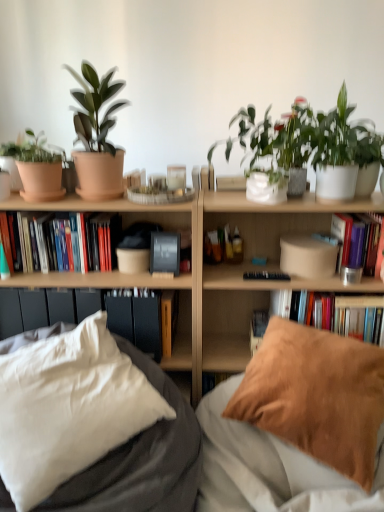
Where is `hardcover book at upper right, the 2th book when ordered from left to right`? hardcover book at upper right, the 2th book when ordered from left to right is located at coordinates (344, 314).

What do you see at coordinates (266, 189) in the screenshot? Image resolution: width=384 pixels, height=512 pixels. I see `white matte flowerpot at center, which appears as the 1th flowerpot when viewed from the right` at bounding box center [266, 189].

The width and height of the screenshot is (384, 512). Find the location of `wooden bookcase at upper center`. wooden bookcase at upper center is located at coordinates point(219,273).

What is the approximate height of wooden bookcase at upper center?

wooden bookcase at upper center is 1.04 meters in height.

How much space does matte terracotta pot at left, acting as the 1th houseplant starting from the left, occupy horizontally?

matte terracotta pot at left, acting as the 1th houseplant starting from the left, is 8.98 inches in width.

Find the location of a particular element. black matte book at center, which is counted as the second paperback book, starting from the top is located at coordinates (147, 322).

Consider the image. How much space does black matte book at center, which appears as the 1th paperback book when viewed from the top, occupy horizontally?

black matte book at center, which appears as the 1th paperback book when viewed from the top, is 2.74 inches in width.

Describe the element at coordinates (97, 136) in the screenshot. The image size is (384, 512). I see `matte terracotta pot at upper left, which ranks as the 2th houseplant in right-to-left order` at that location.

This screenshot has width=384, height=512. In order to click on hardcover book at upper right, the 2th book when ordered from left to right in this screenshot , I will do `click(344, 314)`.

Does wooden bookcase at upper center have a larger size compared to matte terracotta pot at upper left, which ranks as the 2th houseplant in right-to-left order?

Correct, wooden bookcase at upper center is larger in size than matte terracotta pot at upper left, which ranks as the 2th houseplant in right-to-left order.

From the image's perspective, would you say wooden bookcase at upper center is shown under matte terracotta pot at upper left, the second houseplant from the left?

Indeed, from the image's perspective, wooden bookcase at upper center is shown beneath matte terracotta pot at upper left, the second houseplant from the left.

Can we say wooden bookcase at upper center lies outside matte terracotta pot at upper left, the second houseplant from the left?

Yes, wooden bookcase at upper center is located beyond the bounds of matte terracotta pot at upper left, the second houseplant from the left.

Considering the relative sizes of wooden bookcase at upper center and matte terracotta pot at upper left, which ranks as the 2th houseplant in right-to-left order, in the image provided, is wooden bookcase at upper center thinner than matte terracotta pot at upper left, which ranks as the 2th houseplant in right-to-left order,?

Incorrect, the width of wooden bookcase at upper center is not less than that of matte terracotta pot at upper left, which ranks as the 2th houseplant in right-to-left order.

The width and height of the screenshot is (384, 512). In order to click on the 3rd flowerpot above when counting from the black matte book at center, placed as the 2th paperback book when sorted from bottom to top (from the image's perspective) in this screenshot , I will do `click(41, 181)`.

What's the angular difference between matte clay pot at left, marked as the 3th flowerpot in a bottom-to-top arrangement, and black matte book at center, placed as the 2th paperback book when sorted from bottom to top,'s facing directions?

The angular difference between matte clay pot at left, marked as the 3th flowerpot in a bottom-to-top arrangement, and black matte book at center, placed as the 2th paperback book when sorted from bottom to top, is 1.54 degrees.

Considering their positions, is matte clay pot at left, acting as the first flowerpot starting from the top, located in front of or behind black matte book at center, which is counted as the second paperback book, starting from the top?

matte clay pot at left, acting as the first flowerpot starting from the top, is positioned closer to the viewer than black matte book at center, which is counted as the second paperback book, starting from the top.

From the image's perspective, is matte clay pot at left, which appears as the 3th flowerpot when viewed from the right, located beneath black matte book at center, placed as the 2th paperback book when sorted from bottom to top?

Actually, matte clay pot at left, which appears as the 3th flowerpot when viewed from the right, appears above black matte book at center, placed as the 2th paperback book when sorted from bottom to top, in the image.

Looking at this image, could you tell me if green matte plant at upper right, the first houseplant when ordered from right to left, is facing hardcover books at left, marked as the first book in a left-to-right arrangement?

No.

From the image's perspective, is green matte plant at upper right, the first houseplant when ordered from right to left, above hardcover books at left, marked as the first book in a left-to-right arrangement?

Yes, from the image's perspective, green matte plant at upper right, the first houseplant when ordered from right to left, is on top of hardcover books at left, marked as the first book in a left-to-right arrangement.

From the image's perspective, count 1st books downward from the green matte plant at upper right, which appears as the 3th houseplant when viewed from the left, and point to it. Please provide its 2D coordinates.

[(69, 241)]

Based on their positions, is green matte plant at upper right, the first houseplant when ordered from right to left, located to the left or right of hardcover books at left, marked as the first book in a left-to-right arrangement?

green matte plant at upper right, the first houseplant when ordered from right to left, is positioned on hardcover books at left, marked as the first book in a left-to-right arrangement,'s right side.

Is hardcover book at upper right, the second book when ordered from right to left, wider or thinner than black matte book at center, the third paperback book in the bottom-to-top sequence?

Clearly, hardcover book at upper right, the second book when ordered from right to left, has more width compared to black matte book at center, the third paperback book in the bottom-to-top sequence.

Is hardcover book at upper right, the 2th book when ordered from left to right, bigger than black matte book at center, the third paperback book in the bottom-to-top sequence?

Indeed, hardcover book at upper right, the 2th book when ordered from left to right, has a larger size compared to black matte book at center, the third paperback book in the bottom-to-top sequence.

In terms of height, does hardcover book at upper right, the second book when ordered from right to left, look taller or shorter compared to black matte book at center, the third paperback book in the bottom-to-top sequence?

hardcover book at upper right, the second book when ordered from right to left, is taller than black matte book at center, the third paperback book in the bottom-to-top sequence.

Is wooden bookcase at upper center oriented towards brown suede pillow at lower right, which is the second pillow from left to right?

No.

Which is in front, wooden bookcase at upper center or brown suede pillow at lower right, the first pillow when ordered from right to left?

brown suede pillow at lower right, the first pillow when ordered from right to left, is closer to the camera.

Which object is thinner, wooden bookcase at upper center or brown suede pillow at lower right, which is the second pillow from left to right?

brown suede pillow at lower right, which is the second pillow from left to right.

In terms of height, does wooden bookcase at upper center look taller or shorter compared to brown suede pillow at lower right, which is the second pillow from left to right?

In the image, wooden bookcase at upper center appears to be taller than brown suede pillow at lower right, which is the second pillow from left to right.

Considering the positions of objects matte brown pot at center, the second flowerpot viewed from the left, and white soft pillow at lower left, the 1th pillow positioned from the left, in the image provided, who is behind, matte brown pot at center, the second flowerpot viewed from the left, or white soft pillow at lower left, the 1th pillow positioned from the left,?

Positioned behind is matte brown pot at center, the second flowerpot viewed from the left.

Is matte brown pot at center, which is the 1th flowerpot in bottom-to-top order, positioned beyond the bounds of white soft pillow at lower left, the second pillow from the right?

Absolutely, matte brown pot at center, which is the 1th flowerpot in bottom-to-top order, is external to white soft pillow at lower left, the second pillow from the right.

Which point is more distant from viewer, (130,255) or (43,486)?

The point (130,255) is behind.

Is matte brown pot at center, the second flowerpot viewed from the left, positioned far away from white soft pillow at lower left, the 1th pillow positioned from the left?

No, matte brown pot at center, the second flowerpot viewed from the left, is not far from white soft pillow at lower left, the 1th pillow positioned from the left.

Considering the relative sizes of black matte book at center, the third paperback book in the bottom-to-top sequence, and wooden bookcase at upper center in the image provided, is black matte book at center, the third paperback book in the bottom-to-top sequence, smaller than wooden bookcase at upper center?

Indeed, black matte book at center, the third paperback book in the bottom-to-top sequence, has a smaller size compared to wooden bookcase at upper center.

Is point (158, 233) positioned in front of point (255, 237)?

Yes, point (158, 233) is closer to viewer.

Is wooden bookcase at upper center at the back of black matte book at center, the third paperback book in the bottom-to-top sequence?

Absolutely, black matte book at center, the third paperback book in the bottom-to-top sequence, is directed away from wooden bookcase at upper center.

At what (x,y) coordinates should I click in order to perform the action: click on the 3rd houseplant positioned above the wooden bookcase at upper center (from a real-world perspective). Please return your answer as a coordinate pair (x, y). Looking at the image, I should click on (97, 136).

Identify the location of the 2nd paperback book positioned below the matte clay pot at left, acting as the 1th flowerpot starting from the left (from the image's perspective). (147, 322).

Considering their positions, is matte clay pot at left, which appears as the 3th flowerpot when viewed from the right, positioned closer to matte terracotta pot at left, the third houseplant in the right-to-left sequence, than white matte flowerpot at center, the second flowerpot positioned from the bottom?

matte clay pot at left, which appears as the 3th flowerpot when viewed from the right.

From the image, which object appears to be nearer to matte terracotta pot at left, acting as the 1th houseplant starting from the left, matte brown pot at center, which is the 1th flowerpot in bottom-to-top order, or hardcover book at upper right, the second book when ordered from right to left?

matte brown pot at center, which is the 1th flowerpot in bottom-to-top order, is positioned closer to the anchor matte terracotta pot at left, acting as the 1th houseplant starting from the left.

Estimate the real-world distances between objects in this image. Which object is further from hardcover book at upper right, the third book from the left, green matte plant at upper right, the first houseplant when ordered from right to left, or matte brown pot at center, the second flowerpot viewed from the left?

Based on the image, matte brown pot at center, the second flowerpot viewed from the left, appears to be further to hardcover book at upper right, the third book from the left.

Looking at the image, which one is located closer to matte terracotta pot at upper left, the second houseplant from the left, green matte plant at upper right, the first houseplant when ordered from right to left, or white matte flowerpot at center, the second flowerpot positioned from the bottom?

Among the two, white matte flowerpot at center, the second flowerpot positioned from the bottom, is located nearer to matte terracotta pot at upper left, the second houseplant from the left.

Looking at this image, looking at the image, which one is located closer to green matte plant at upper right, which appears as the 3th houseplant when viewed from the left, hardcover books at left, which appears as the 3th book when viewed from the right, or matte brown pot at center, the second flowerpot viewed from the left?

The object closer to green matte plant at upper right, which appears as the 3th houseplant when viewed from the left, is matte brown pot at center, the second flowerpot viewed from the left.

Based on their spatial positions, is matte terracotta pot at left, acting as the 1th houseplant starting from the left, or brown suede pillow at lower right, the first pillow when ordered from right to left, further from white matte flowerpot at center, the second flowerpot positioned from the bottom?

matte terracotta pot at left, acting as the 1th houseplant starting from the left.

Estimate the real-world distances between objects in this image. Which object is closer to matte brown pot at center, the second flowerpot viewed from the left, black matte book at center, the third paperback book in the bottom-to-top sequence, or matte clay pot at left, marked as the 3th flowerpot in a bottom-to-top arrangement?

black matte book at center, the third paperback book in the bottom-to-top sequence, lies closer to matte brown pot at center, the second flowerpot viewed from the left, than the other object.

Considering their positions, is matte clay pot at left, marked as the 3th flowerpot in a bottom-to-top arrangement, positioned further to wooden bookcase at upper center than white matte flowerpot at center, the second flowerpot positioned from the bottom?

matte clay pot at left, marked as the 3th flowerpot in a bottom-to-top arrangement.

The height and width of the screenshot is (512, 384). Find the location of `houseplant situated between black matte book at center, the third paperback book in the bottom-to-top sequence, and hardcover book at upper right, the third book from the left, from left to right`. houseplant situated between black matte book at center, the third paperback book in the bottom-to-top sequence, and hardcover book at upper right, the third book from the left, from left to right is located at coordinates (308, 140).

Locate an element on the screen. This screenshot has width=384, height=512. bookcase between matte clay pot at left, acting as the 1th flowerpot starting from the left, and white soft pillow at lower left, the 1th pillow positioned from the left, from top to bottom is located at coordinates (219, 273).

Image resolution: width=384 pixels, height=512 pixels. Identify the location of bookcase between black matte book at center, which appears as the 1th paperback book when viewed from the top, and hardcover book at upper right, the third book from the left, from left to right. (219, 273).

The height and width of the screenshot is (512, 384). What are the coordinates of `paperback book that lies between matte terracotta pot at upper left, the second houseplant from the left, and matte brown pot at center, the second flowerpot viewed from the left, from top to bottom` in the screenshot? It's located at (165, 253).